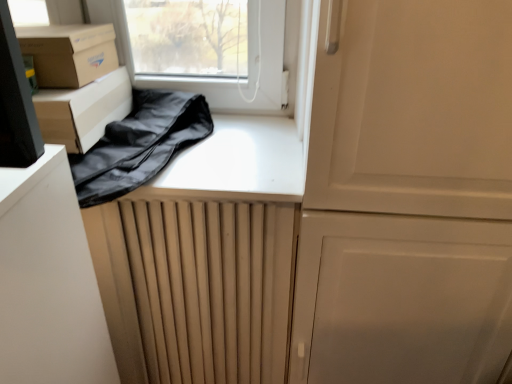
Question: Looking at their shapes, would you say black fabric bag at upper left is wider or thinner than brown cardboard box at upper left, the 2th cardboard box from the bottom?

Choices:
 (A) thin
 (B) wide

Answer: (B)

Question: From the image's perspective, is black fabric bag at upper left located above or below brown cardboard box at upper left, the first cardboard box in the top-to-bottom sequence?

Choices:
 (A) above
 (B) below

Answer: (B)

Question: Which object is positioned farthest from the matte cardboard box at left, the 2th cardboard box when ordered from top to bottom?

Choices:
 (A) black fabric bag at upper left
 (B) brown cardboard box at upper left, the 2th cardboard box from the bottom

Answer: (A)

Question: Based on their relative distances, which object is nearer to the brown cardboard box at upper left, the first cardboard box in the top-to-bottom sequence?

Choices:
 (A) matte cardboard box at left, which is counted as the 1th cardboard box, starting from the bottom
 (B) black fabric bag at upper left

Answer: (A)